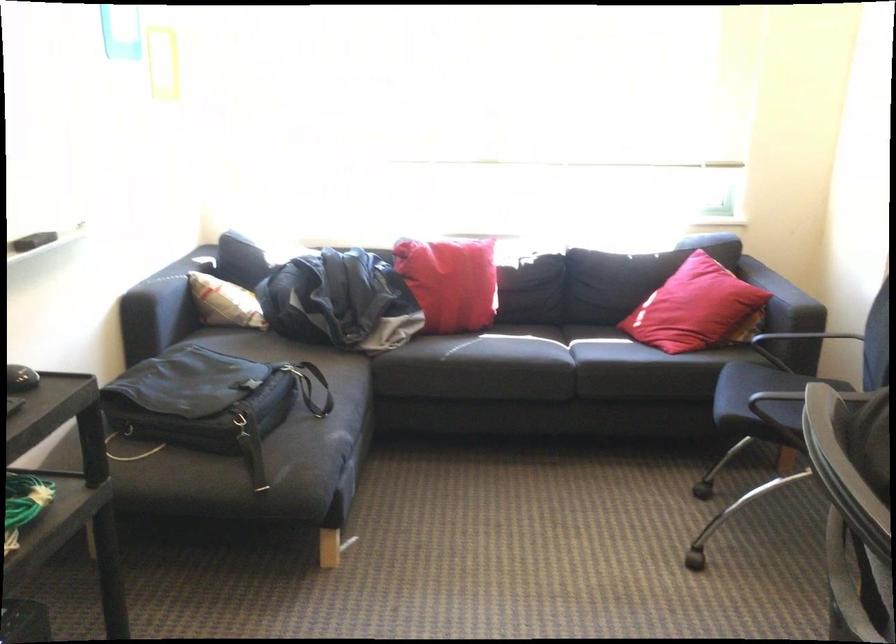
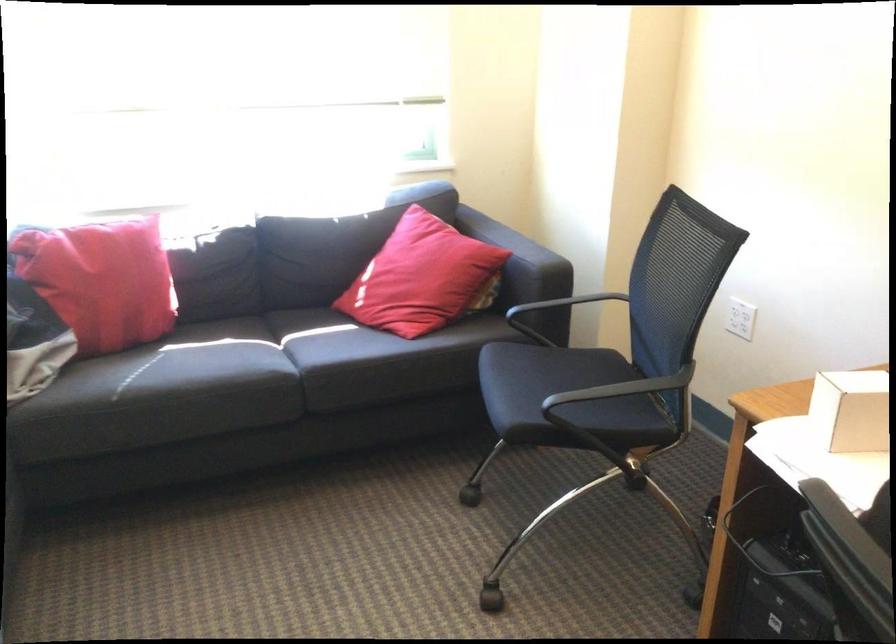
Question: The images are taken continuously from a first-person perspective. In which direction are you moving?

Choices:
 (A) Left
 (B) Right
 (C) Forward
 (D) Backward

Answer: (C)